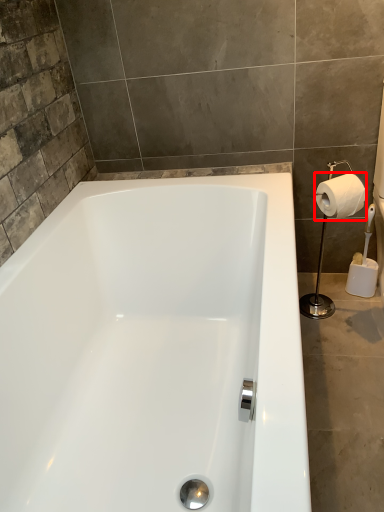
Question: From the image's perspective, where is toilet paper (annotated by the red box) located in relation to shower in the image?

Choices:
 (A) above
 (B) below

Answer: (A)